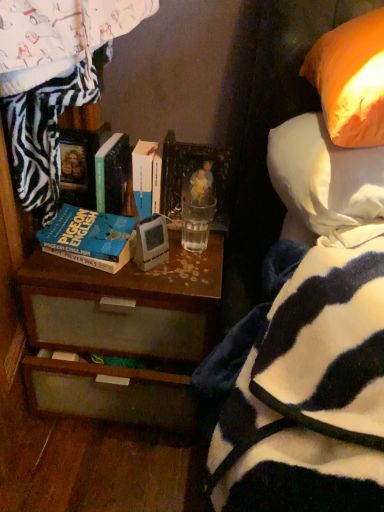
Question: Could you tell me if hardcover book at center, which is counted as the second book, starting from the left, is turned towards blue matte book at center left, which appears as the 1th book when viewed from the left?

Choices:
 (A) no
 (B) yes

Answer: (B)

Question: Considering the relative sizes of hardcover book at center, the second book from the right, and blue matte book at center left, the 3th book viewed from the right, in the image provided, is hardcover book at center, the second book from the right, taller than blue matte book at center left, the 3th book viewed from the right,?

Choices:
 (A) yes
 (B) no

Answer: (A)

Question: Is blue matte book at center left, the 3th book viewed from the right, inside hardcover book at center, which is counted as the second book, starting from the left?

Choices:
 (A) yes
 (B) no

Answer: (B)

Question: Can you confirm if hardcover book at center, the second book from the right, is thinner than blue matte book at center left, the 3th book viewed from the right?

Choices:
 (A) no
 (B) yes

Answer: (A)

Question: Is hardcover book at center, the second book from the right, to the left of blue matte book at center left, which appears as the 1th book when viewed from the left, from the viewer's perspective?

Choices:
 (A) no
 (B) yes

Answer: (A)

Question: In terms of size, does orange fabric pillow at upper right appear bigger or smaller than clear glass at center?

Choices:
 (A) small
 (B) big

Answer: (B)

Question: Is orange fabric pillow at upper right in front of or behind clear glass at center in the image?

Choices:
 (A) behind
 (B) front

Answer: (B)

Question: Considering the positions of point (306, 146) and point (185, 202), is point (306, 146) closer or farther from the camera than point (185, 202)?

Choices:
 (A) farther
 (B) closer

Answer: (B)

Question: Visually, is orange fabric pillow at upper right positioned to the left or to the right of clear glass at center?

Choices:
 (A) right
 (B) left

Answer: (A)

Question: From a real-world perspective, relative to blue matte book at center left, which appears as the 1th book when viewed from the left, is clear glass at center vertically above or below?

Choices:
 (A) below
 (B) above

Answer: (A)

Question: In terms of height, does clear glass at center look taller or shorter compared to blue matte book at center left, which appears as the 1th book when viewed from the left?

Choices:
 (A) tall
 (B) short

Answer: (B)

Question: In the image, is clear glass at center on the left side or the right side of blue matte book at center left, the 3th book viewed from the right?

Choices:
 (A) left
 (B) right

Answer: (B)

Question: Is clear glass at center wider or thinner than blue matte book at center left, which appears as the 1th book when viewed from the left?

Choices:
 (A) thin
 (B) wide

Answer: (A)

Question: Does point (223, 172) appear closer or farther from the camera than point (114, 200)?

Choices:
 (A) closer
 (B) farther

Answer: (B)

Question: Is matte plastic picture frame at upper center inside the boundaries of hardcover book at center, the second book from the right, or outside?

Choices:
 (A) outside
 (B) inside

Answer: (A)